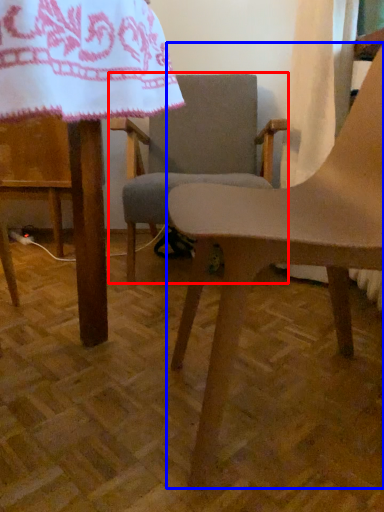
Question: Which of the following is the farthest to the observer, chair (highlighted by a red box) or chair (highlighted by a blue box)?

Choices:
 (A) chair
 (B) chair

Answer: (A)